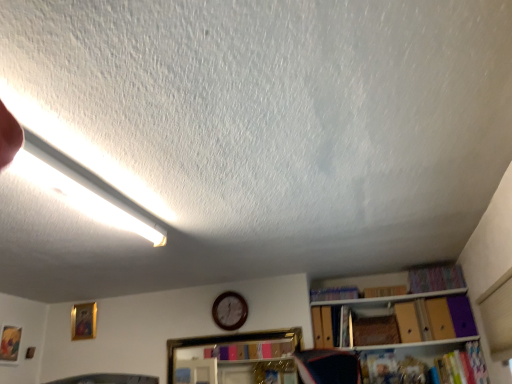
Question: Can you confirm if gold-framed picture at upper left, arranged as the first picture frame when viewed from the right, is positioned to the left of white fluorescent tube at upper left?

Choices:
 (A) no
 (B) yes

Answer: (B)

Question: From a real-world perspective, is gold-framed picture at upper left, marked as the 1th picture frame in a back-to-front arrangement, positioned under white fluorescent tube at upper left based on gravity?

Choices:
 (A) yes
 (B) no

Answer: (A)

Question: Does gold-framed picture at upper left, the 2th picture frame from the left, have a lesser height compared to white fluorescent tube at upper left?

Choices:
 (A) no
 (B) yes

Answer: (A)

Question: Is white fluorescent tube at upper left at the back of gold-framed picture at upper left, which is counted as the 2th picture frame, starting from the front?

Choices:
 (A) yes
 (B) no

Answer: (B)

Question: Can you confirm if gold-framed picture at upper left, marked as the 1th picture frame in a back-to-front arrangement, is smaller than white fluorescent tube at upper left?

Choices:
 (A) yes
 (B) no

Answer: (A)

Question: Considering the positions of multicolored fabric book at upper right, marked as the 4th book in a bottom-to-top arrangement, and wooden shelf at center in the image, is multicolored fabric book at upper right, marked as the 4th book in a bottom-to-top arrangement, wider or thinner than wooden shelf at center?

Choices:
 (A) thin
 (B) wide

Answer: (B)

Question: In terms of size, does multicolored fabric book at upper right, the 1th book from the top, appear bigger or smaller than wooden shelf at center?

Choices:
 (A) big
 (B) small

Answer: (B)

Question: From the image's perspective, is multicolored fabric book at upper right, the 1th book from the top, positioned above or below wooden shelf at center?

Choices:
 (A) above
 (B) below

Answer: (A)

Question: Is multicolored fabric book at upper right, the 1th book from the top, taller or shorter than wooden shelf at center?

Choices:
 (A) short
 (B) tall

Answer: (A)

Question: In the image, is purple cardboard book at upper right, placed as the second book when sorted from top to bottom, on the left side or the right side of gold-framed picture at upper left, the 2th picture frame from the left?

Choices:
 (A) right
 (B) left

Answer: (A)

Question: From the image's perspective, is purple cardboard book at upper right, the third book ordered from the bottom, located above or below gold-framed picture at upper left, the 2th picture frame from the left?

Choices:
 (A) above
 (B) below

Answer: (A)

Question: From a real-world perspective, is purple cardboard book at upper right, placed as the second book when sorted from top to bottom, above or below gold-framed picture at upper left, marked as the 1th picture frame in a back-to-front arrangement?

Choices:
 (A) below
 (B) above

Answer: (B)

Question: Looking at their shapes, would you say purple cardboard book at upper right, the third book ordered from the bottom, is wider or thinner than gold-framed picture at upper left, which is counted as the 2th picture frame, starting from the front?

Choices:
 (A) wide
 (B) thin

Answer: (A)

Question: From the image's perspective, is wooden shelf at center above or below matte gold picture frame at lower left, arranged as the 2th picture frame when viewed from the right?

Choices:
 (A) below
 (B) above

Answer: (A)

Question: Is wooden shelf at center to the left or to the right of matte gold picture frame at lower left, positioned as the 1th picture frame in left-to-right order, in the image?

Choices:
 (A) right
 (B) left

Answer: (A)